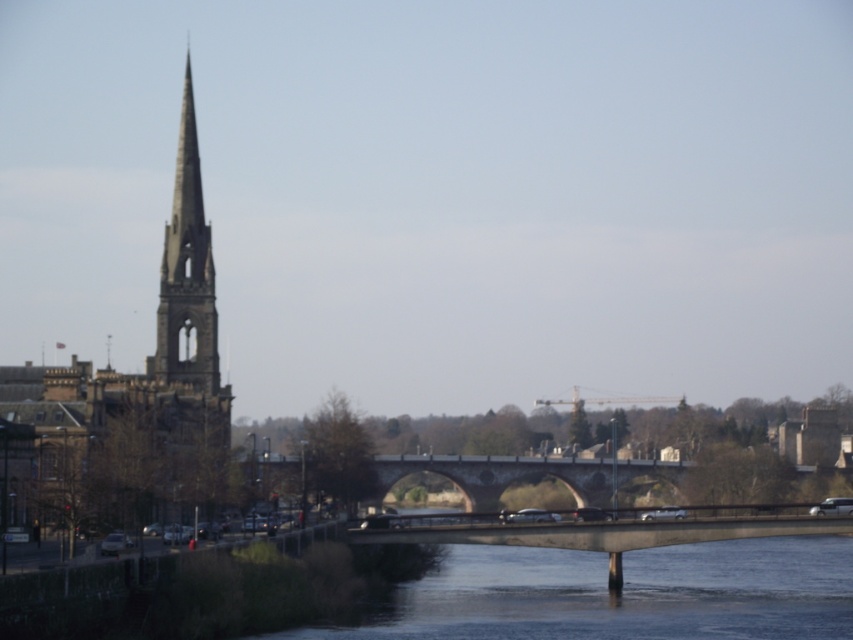
Does dark gray stone church steeple at left have a larger size compared to smooth stone spire at left?

Yes.

Is dark gray stone church steeple at left taller than smooth stone spire at left?

Yes, dark gray stone church steeple at left is taller than smooth stone spire at left.

Is point (27, 401) closer to viewer compared to point (183, 145)?

Yes, point (27, 401) is in front of point (183, 145).

Where is `dark gray stone church steeple at left`? The width and height of the screenshot is (853, 640). dark gray stone church steeple at left is located at coordinates (143, 376).

What do you see at coordinates (619, 595) in the screenshot? I see `dark gray concrete bridge at lower center` at bounding box center [619, 595].

I want to click on dark gray concrete bridge at lower center, so click(619, 595).

Find the location of a particular element. The width and height of the screenshot is (853, 640). dark gray concrete bridge at lower center is located at coordinates (619, 595).

Who is lower down, dark gray concrete bridge at lower center or smooth stone spire at left?

dark gray concrete bridge at lower center is below.

Who is more distant from viewer, (722, 600) or (190, 385)?

The point (190, 385) is behind.

This screenshot has height=640, width=853. Describe the element at coordinates (619, 595) in the screenshot. I see `dark gray concrete bridge at lower center` at that location.

This screenshot has width=853, height=640. Find the location of `dark gray concrete bridge at lower center`. dark gray concrete bridge at lower center is located at coordinates (619, 595).